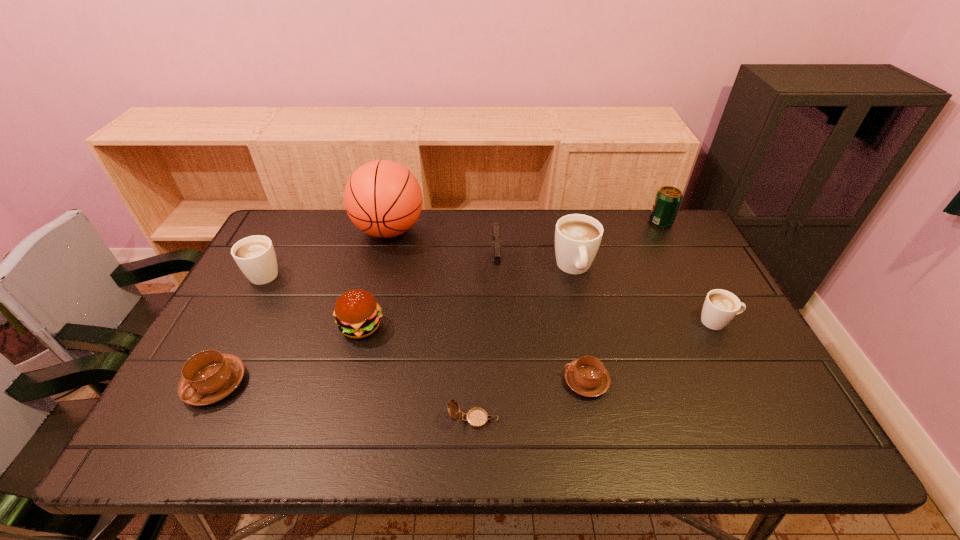
The width and height of the screenshot is (960, 540). I want to click on pistol positioned at the far edge, so (496, 240).

The image size is (960, 540). Find the location of `object that is at the near edge`. object that is at the near edge is located at coordinates (477, 418).

The image size is (960, 540). In order to click on beer can situated at the right edge in this screenshot , I will do `click(668, 199)`.

Where is `cappuccino that is at the right edge`? This screenshot has height=540, width=960. cappuccino that is at the right edge is located at coordinates (720, 306).

Image resolution: width=960 pixels, height=540 pixels. I want to click on object that is at the far right corner, so click(x=668, y=199).

This screenshot has width=960, height=540. Identify the location of free space at the far edge of the desktop. (490, 225).

The width and height of the screenshot is (960, 540). In order to click on free region at the near edge in this screenshot , I will do `click(734, 453)`.

The image size is (960, 540). What are the coordinates of `free location at the left edge` in the screenshot? It's located at (229, 307).

This screenshot has width=960, height=540. In the image, there is a desktop. What are the coordinates of `vacant region at the right edge` in the screenshot? It's located at (703, 305).

I want to click on vacant space at the far right corner of the desktop, so click(x=669, y=241).